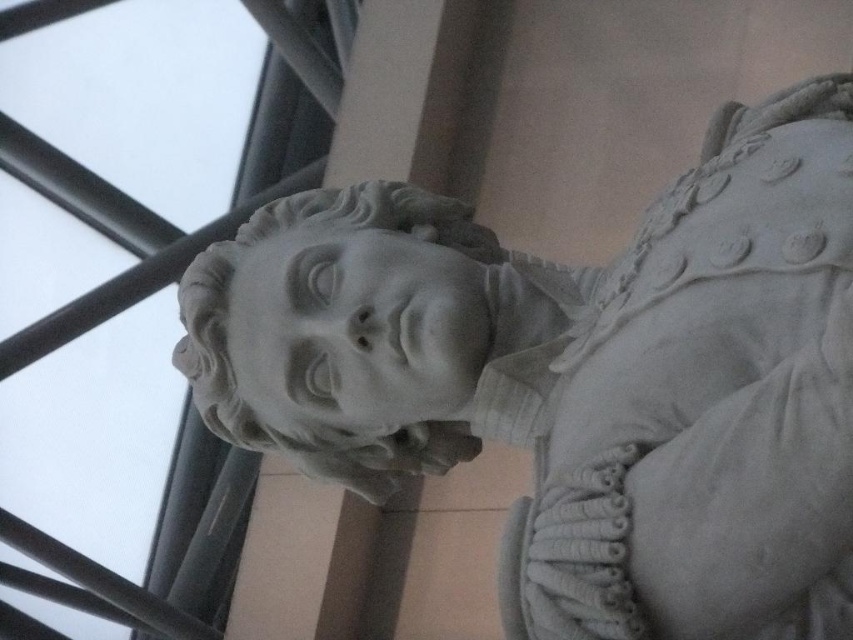
Question: Which point appears closest to the camera in this image?

Choices:
 (A) (300, 209)
 (B) (625, 320)

Answer: (B)

Question: Is white marble bust at center thinner than white marble head at center?

Choices:
 (A) yes
 (B) no

Answer: (B)

Question: Is white marble bust at center bigger than white marble head at center?

Choices:
 (A) no
 (B) yes

Answer: (B)

Question: Which of the following is the farthest from the observer?

Choices:
 (A) white marble head at center
 (B) white marble bust at center

Answer: (A)

Question: Can you confirm if white marble bust at center is positioned to the right of white marble head at center?

Choices:
 (A) no
 (B) yes

Answer: (B)